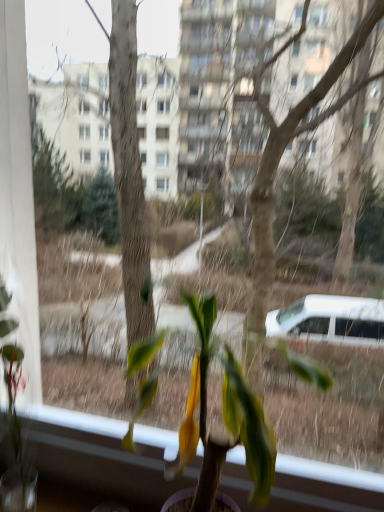
Question: Does green matte plant at left, which is counted as the 2th houseplant, starting from the right, appear on the left side of green matte plant at center, arranged as the 2th houseplant when viewed from the left?

Choices:
 (A) no
 (B) yes

Answer: (B)

Question: Does green matte plant at left, which ranks as the first houseplant in left-to-right order, appear on the right side of green matte plant at center, the 1th houseplant in the right-to-left sequence?

Choices:
 (A) yes
 (B) no

Answer: (B)

Question: Is green matte plant at left, which is counted as the 2th houseplant, starting from the right, positioned with its back to green matte plant at center, the 1th houseplant in the right-to-left sequence?

Choices:
 (A) yes
 (B) no

Answer: (B)

Question: Can you confirm if green matte plant at left, which is counted as the 2th houseplant, starting from the right, is taller than green matte plant at center, arranged as the 2th houseplant when viewed from the left?

Choices:
 (A) no
 (B) yes

Answer: (B)

Question: Would you say green matte plant at left, which is counted as the 2th houseplant, starting from the right, is a long distance from green matte plant at center, arranged as the 2th houseplant when viewed from the left?

Choices:
 (A) yes
 (B) no

Answer: (B)

Question: Is green matte plant at left, which ranks as the first houseplant in left-to-right order, closer to the viewer compared to green matte plant at center, arranged as the 2th houseplant when viewed from the left?

Choices:
 (A) no
 (B) yes

Answer: (A)

Question: From the image's perspective, is green matte plant at center, the 1th houseplant in the right-to-left sequence, on green matte plant at left, which ranks as the first houseplant in left-to-right order?

Choices:
 (A) yes
 (B) no

Answer: (B)

Question: From a real-world perspective, is green matte plant at center, the 1th houseplant in the right-to-left sequence, below green matte plant at left, which ranks as the first houseplant in left-to-right order?

Choices:
 (A) no
 (B) yes

Answer: (A)

Question: Is green matte plant at center, the 1th houseplant in the right-to-left sequence, looking in the opposite direction of green matte plant at left, which ranks as the first houseplant in left-to-right order?

Choices:
 (A) yes
 (B) no

Answer: (B)

Question: Considering the relative sizes of green matte plant at center, the 1th houseplant in the right-to-left sequence, and green matte plant at left, which is counted as the 2th houseplant, starting from the right, in the image provided, is green matte plant at center, the 1th houseplant in the right-to-left sequence, wider than green matte plant at left, which is counted as the 2th houseplant, starting from the right,?

Choices:
 (A) no
 (B) yes

Answer: (B)

Question: Can you see green matte plant at center, the 1th houseplant in the right-to-left sequence, touching green matte plant at left, which is counted as the 2th houseplant, starting from the right?

Choices:
 (A) yes
 (B) no

Answer: (B)

Question: Does green matte plant at center, the 1th houseplant in the right-to-left sequence, have a greater height compared to green matte plant at left, which is counted as the 2th houseplant, starting from the right?

Choices:
 (A) no
 (B) yes

Answer: (A)

Question: Considering the positions of point (29, 468) and point (261, 419), is point (29, 468) closer or farther from the camera than point (261, 419)?

Choices:
 (A) farther
 (B) closer

Answer: (A)